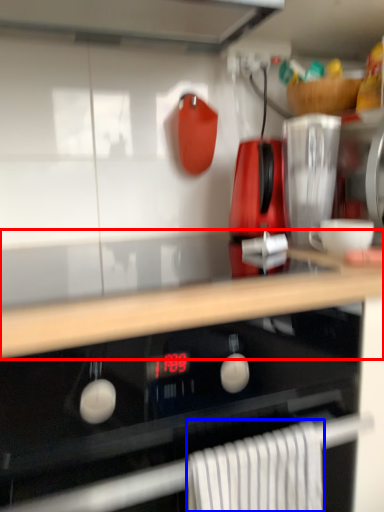
Question: Which object appears closest to the camera in this image, countertop (highlighted by a red box) or bath towel (highlighted by a blue box)?

Choices:
 (A) countertop
 (B) bath towel

Answer: (A)